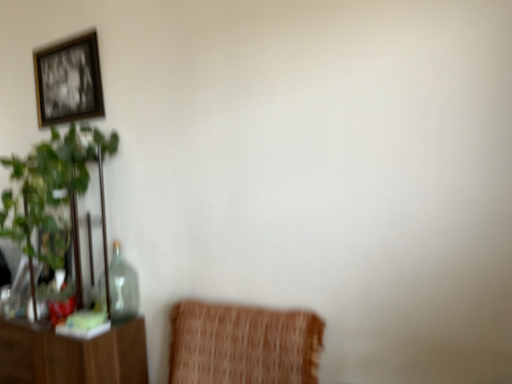
Question: Is gold-framed picture at upper left to the left or to the right of transparent glass bottle at left in the image?

Choices:
 (A) left
 (B) right

Answer: (A)

Question: From a real-world perspective, is gold-framed picture at upper left positioned above or below transparent glass bottle at left?

Choices:
 (A) above
 (B) below

Answer: (A)

Question: Which object is the farthest from the green leafy plant at left?

Choices:
 (A) transparent glass bottle at left
 (B) gold-framed picture at upper left

Answer: (B)

Question: Which object is the farthest from the transparent glass bottle at left?

Choices:
 (A) gold-framed picture at upper left
 (B) green leafy plant at left

Answer: (A)